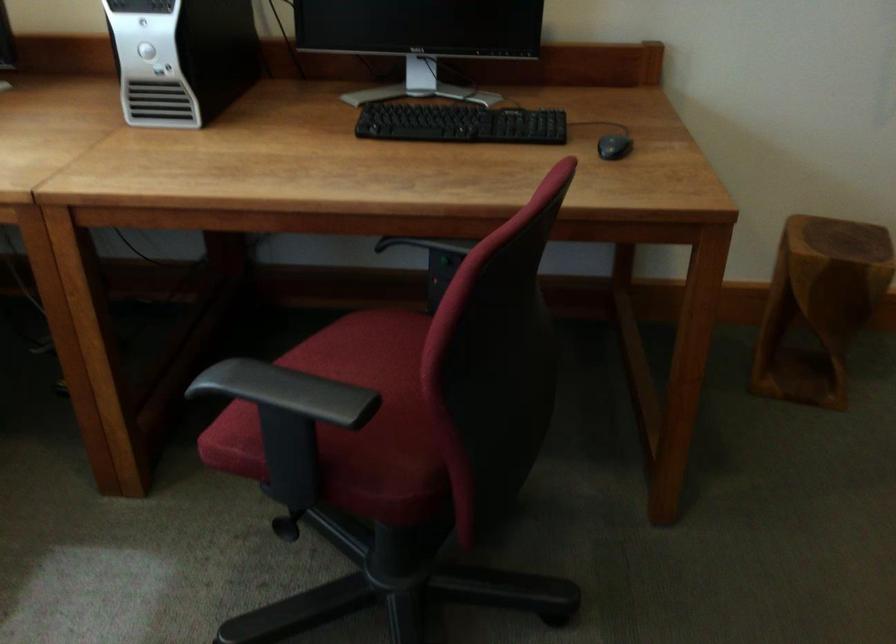
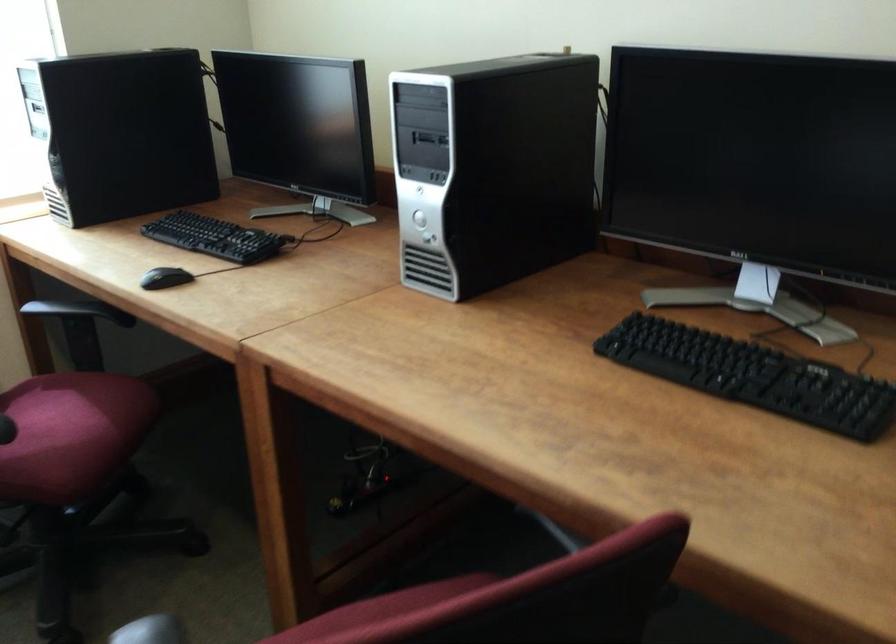
Where in the second image is the point corresponding to point 298,354 from the first image?

(381, 608)